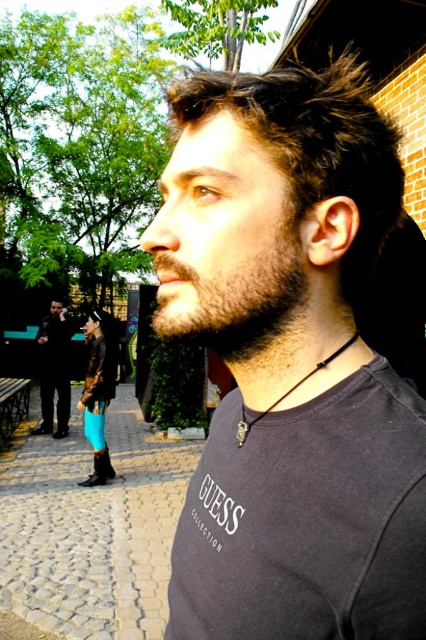
You are a photographer trying to capture a detailed shot of the matte black shirt at center and the black leather jacket at left. Which object should you zoom in on to ensure it takes up more of the frame?

The black leather jacket at left should be zoomed in on because it occupies more space than the matte black shirt at center, making it easier to fill the frame.

You are a fashion designer observing the scene. You need to determine which item of clothing is shorter in height between the matte black shirt at center and the black leather jacket at left. Can you identify which one is shorter?

The matte black shirt at center is shorter in height than the black leather jacket at left according to the description provided.

You are designing a clothing display and need to arrange the matte black shirt at center and the dark gray fleece sweatshirt at lower left side by side. Based on their sizes, which one should you place on the left to ensure they fit within the display area?

Since the matte black shirt at center is narrower than the dark gray fleece sweatshirt at lower left, placing the matte black shirt at center on the left would allow both items to fit better within the display area.